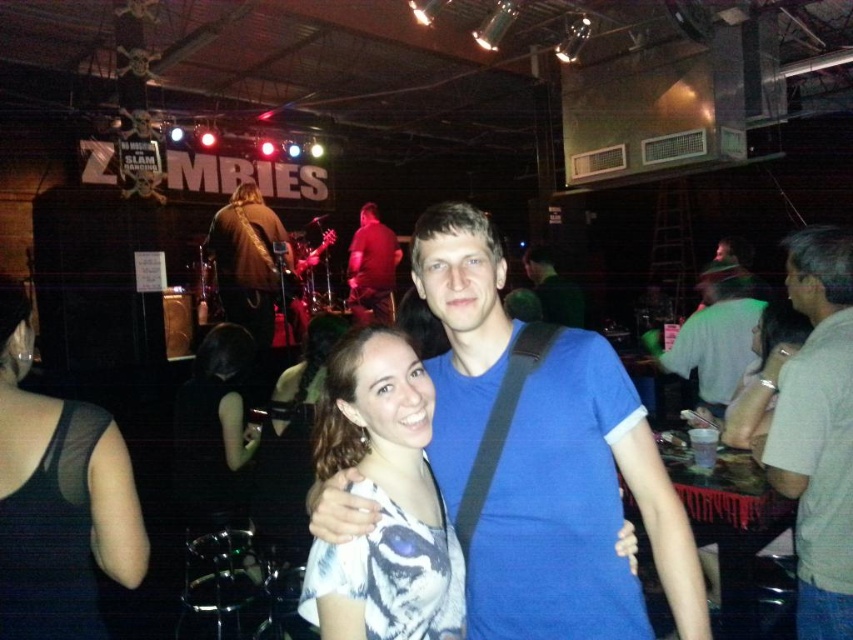
Between brown leather jacket at upper left and blue cotton shirt at center, which one appears on the right side from the viewer's perspective?

From the viewer's perspective, blue cotton shirt at center appears more on the right side.

Which is behind, point (256, 198) or point (532, 272)?

The point (532, 272) is behind.

The image size is (853, 640). What do you see at coordinates (248, 260) in the screenshot? I see `brown leather jacket at upper left` at bounding box center [248, 260].

Where is `brown leather jacket at upper left`? brown leather jacket at upper left is located at coordinates (248, 260).

Image resolution: width=853 pixels, height=640 pixels. I want to click on blue cotton t-shirt at center, so click(578, 512).

Can you confirm if blue cotton t-shirt at center is positioned above dark brown hair at center?

Indeed, blue cotton t-shirt at center is positioned over dark brown hair at center.

Between point (612, 496) and point (270, 481), which one is positioned behind?

The point (270, 481) is behind.

Where is `blue cotton t-shirt at center`? This screenshot has height=640, width=853. blue cotton t-shirt at center is located at coordinates coord(578,512).